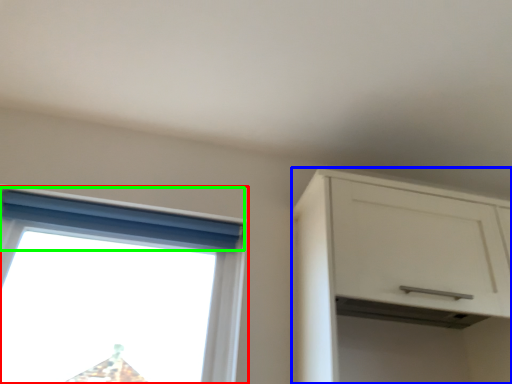
Question: Based on their relative distances, which object is nearer to window (highlighted by a red box)? Choose from cabinetry (highlighted by a blue box) and curtain (highlighted by a green box).

Choices:
 (A) cabinetry
 (B) curtain

Answer: (B)